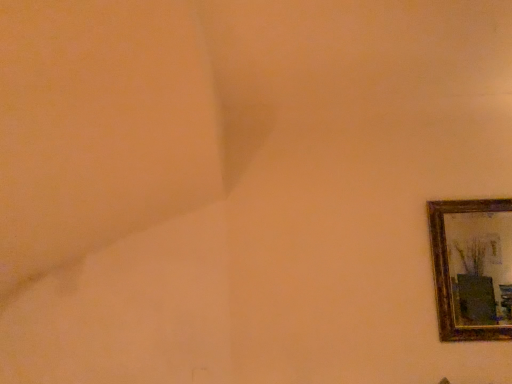
The height and width of the screenshot is (384, 512). What do you see at coordinates (480, 267) in the screenshot?
I see `gold-framed mirror at right` at bounding box center [480, 267].

Where is `gold-framed mirror at right`? The width and height of the screenshot is (512, 384). gold-framed mirror at right is located at coordinates (480, 267).

Where is `gold-framed mirror at right`? Image resolution: width=512 pixels, height=384 pixels. gold-framed mirror at right is located at coordinates (480, 267).